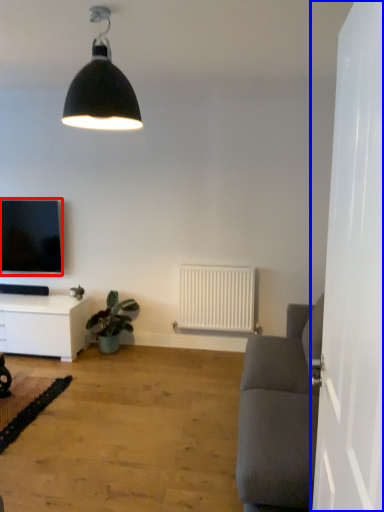
Question: Which object is further to the camera taking this photo, television (highlighted by a red box) or side (highlighted by a blue box)?

Choices:
 (A) television
 (B) side

Answer: (A)